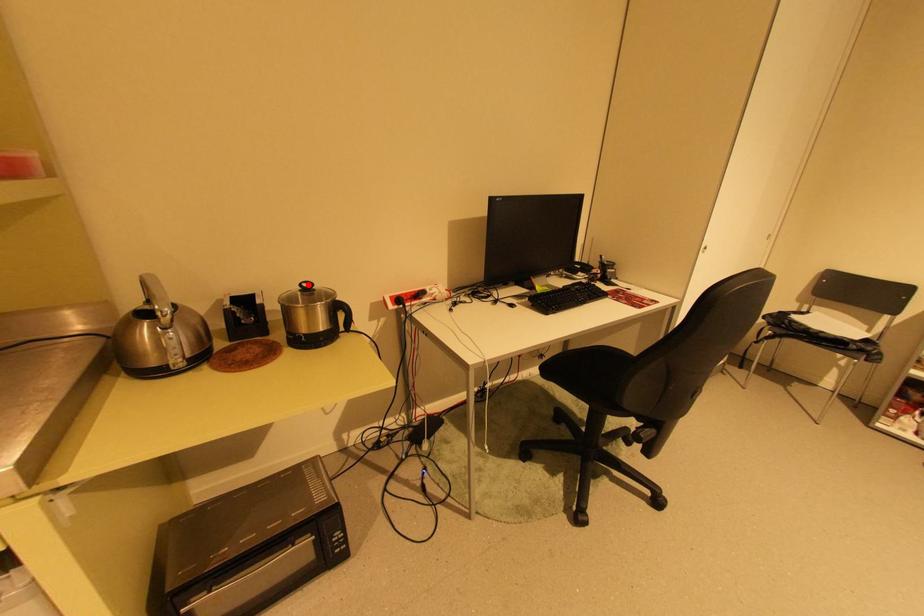
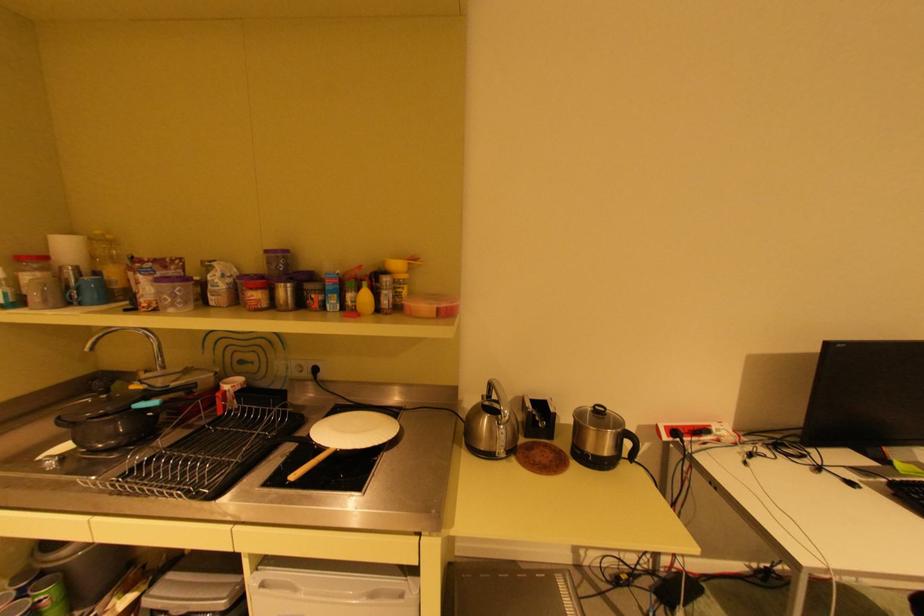
Where in the second image is the point corresponding to the highlighted location from the first image?

(602, 407)